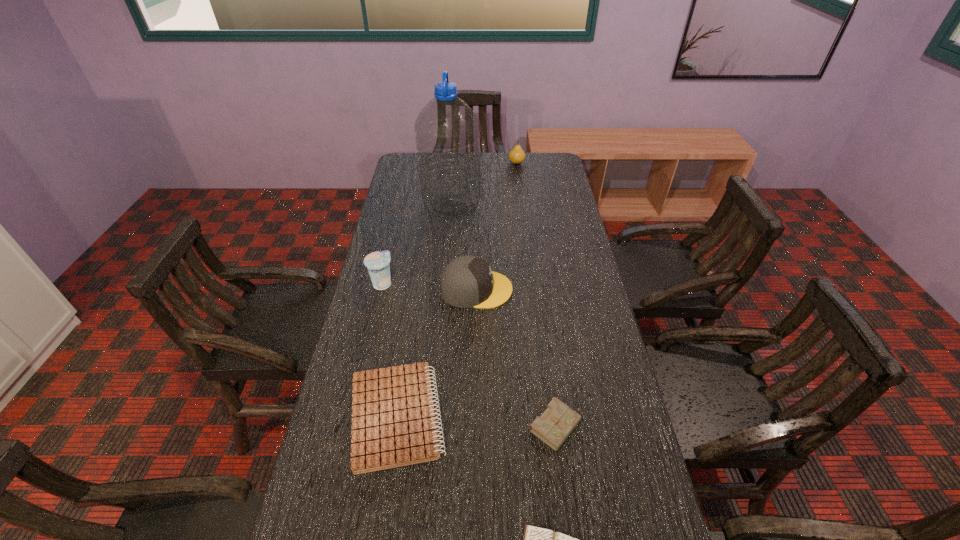
The width and height of the screenshot is (960, 540). In order to click on vacant space situated on the front of the yogurt in this screenshot , I will do `click(371, 334)`.

Find the location of a particular element. free space located 0.200m on the front-facing side of the cap is located at coordinates (573, 289).

The height and width of the screenshot is (540, 960). I want to click on vacant space positioned on the back of the farther diary, so click(x=541, y=312).

I want to click on free spot located 0.300m on the back of the second shortest object, so 416,291.

This screenshot has width=960, height=540. What are the coordinates of `object located in the far edge section of the desktop` in the screenshot? It's located at (517, 155).

Find the location of `water jug that is at the left edge`. water jug that is at the left edge is located at coordinates (447, 131).

Identify the location of yogurt positioned at the left edge. The image size is (960, 540). (378, 263).

Where is `notebook positioned at the left edge`? The width and height of the screenshot is (960, 540). notebook positioned at the left edge is located at coordinates (393, 420).

Find the location of a particular element. object present at the right edge is located at coordinates (553, 427).

Identify the location of free space at the far edge of the desktop. (509, 175).